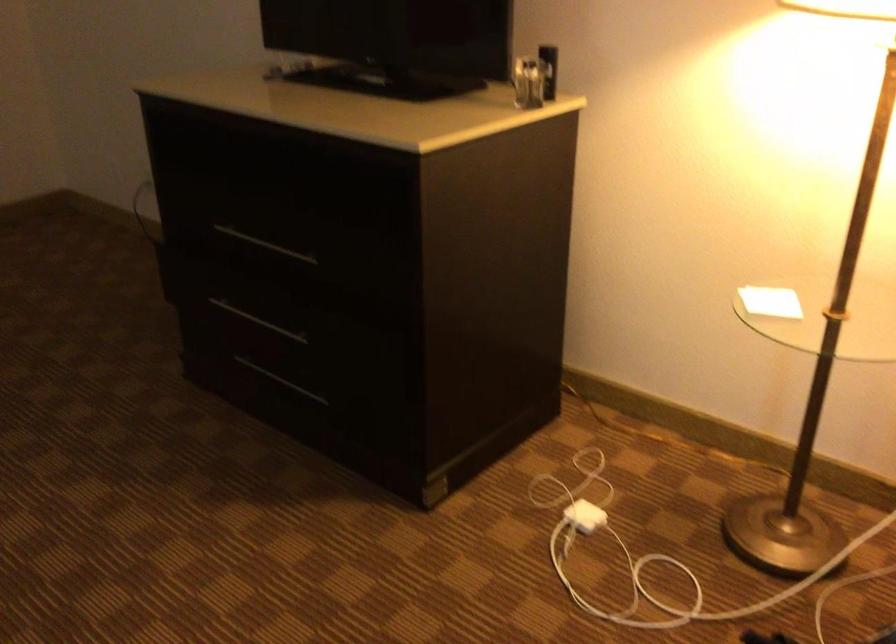
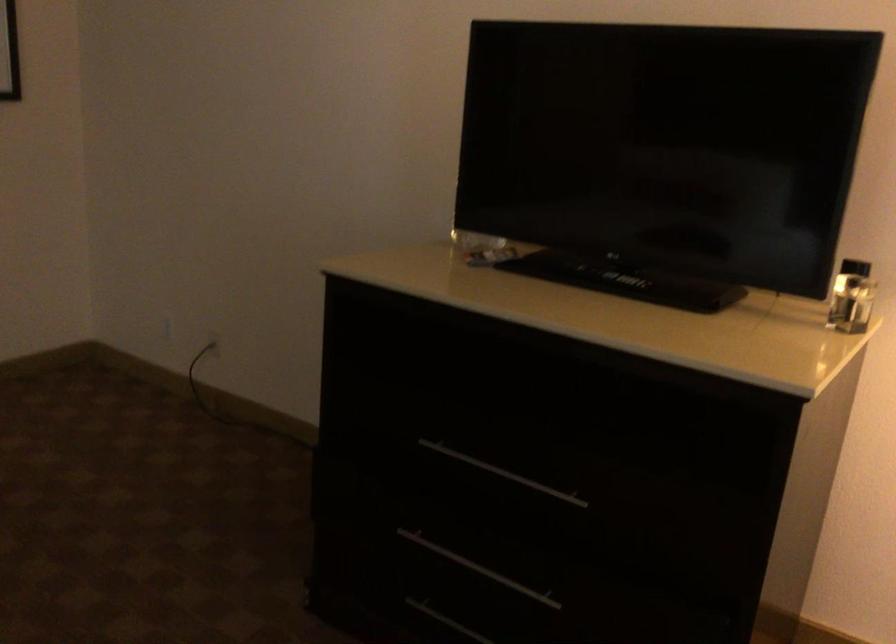
What movement of the cameraman would produce the second image?

The movement direction of the cameraman is left, forward.